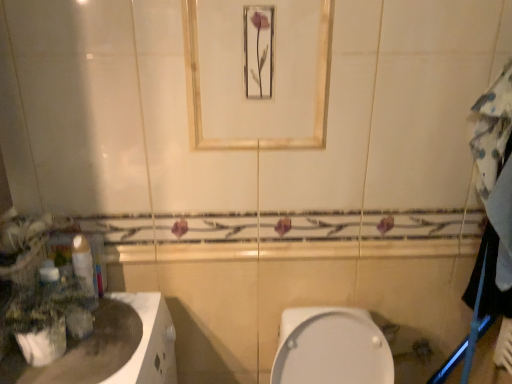
Locate an element on the screen. The height and width of the screenshot is (384, 512). green matte plant at left is located at coordinates (50, 316).

What do you see at coordinates (244, 86) in the screenshot?
I see `matte gold mirror at upper center` at bounding box center [244, 86].

Locate an element on the screen. Image resolution: width=512 pixels, height=384 pixels. white glossy toilet paper at left is located at coordinates (83, 265).

Where is `green matte plant at left`? green matte plant at left is located at coordinates (50, 316).

Between green matte plant at left and white glossy countertop at lower left, which one has smaller width?

green matte plant at left is thinner.

From a real-world perspective, is green matte plant at left over white glossy countertop at lower left?

Indeed, from a real-world perspective, green matte plant at left stands above white glossy countertop at lower left.

The width and height of the screenshot is (512, 384). What are the coordinates of `plant located on the right of white glossy countertop at lower left` in the screenshot? It's located at (50, 316).

Considering the sizes of objects white glossy toilet paper at left and matte gold mirror at upper center in the image provided, who is taller, white glossy toilet paper at left or matte gold mirror at upper center?

matte gold mirror at upper center is taller.

Consider the image. Considering the positions of objects white glossy toilet paper at left and matte gold mirror at upper center in the image provided, who is in front, white glossy toilet paper at left or matte gold mirror at upper center?

matte gold mirror at upper center is closer to the camera.

Is white glossy toilet paper at left positioned with its back to matte gold mirror at upper center?

No, white glossy toilet paper at left is not facing the opposite direction of matte gold mirror at upper center.

How many degrees apart are the facing directions of white glossy toilet paper at left and matte gold mirror at upper center?

There is a 90-degree angle between the facing directions of white glossy toilet paper at left and matte gold mirror at upper center.

Does white glossy countertop at lower left contain matte gold mirror at upper center?

No, matte gold mirror at upper center is not surrounded by white glossy countertop at lower left.

Measure the distance from white glossy countertop at lower left to matte gold mirror at upper center.

white glossy countertop at lower left is 24.92 inches from matte gold mirror at upper center.

Considering the positions of point (109, 356) and point (276, 27), is point (109, 356) closer or farther from the camera than point (276, 27)?

Point (109, 356) is closer to the camera than point (276, 27).

Can you tell me how much white glossy countertop at lower left and matte gold mirror at upper center differ in facing direction?

The angular difference between white glossy countertop at lower left and matte gold mirror at upper center is 90 degrees.

Considering the sizes of objects matte gold mirror at upper center and white glossy countertop at lower left in the image provided, who is smaller, matte gold mirror at upper center or white glossy countertop at lower left?

white glossy countertop at lower left is smaller.

This screenshot has width=512, height=384. I want to click on counter top that appears below the matte gold mirror at upper center (from a real-world perspective), so click(111, 347).

From a real-world perspective, is matte gold mirror at upper center on white glossy countertop at lower left?

Yes, from a real-world perspective, matte gold mirror at upper center is above white glossy countertop at lower left.

Which point is more distant from viewer, (207, 116) or (90, 380)?

The point (207, 116) is behind.

Does matte gold mirror at upper center have a lesser height compared to green matte plant at left?

In fact, matte gold mirror at upper center may be taller than green matte plant at left.

Considering the positions of objects matte gold mirror at upper center and green matte plant at left in the image provided, who is more to the left, matte gold mirror at upper center or green matte plant at left?

Positioned to the left is green matte plant at left.

Looking at this image, from the image's perspective, is matte gold mirror at upper center under green matte plant at left?

No, from the image's perspective, matte gold mirror at upper center is not beneath green matte plant at left.

Considering the sizes of objects matte gold mirror at upper center and green matte plant at left in the image provided, who is bigger, matte gold mirror at upper center or green matte plant at left?

Bigger between the two is green matte plant at left.

From a real-world perspective, relative to white glossy countertop at lower left, is white glossy toilet paper at left vertically above or below?

In terms of real-world spatial position, white glossy toilet paper at left is above white glossy countertop at lower left.

Is there a large distance between white glossy toilet paper at left and white glossy countertop at lower left?

They are positioned close to each other.

From the image's perspective, between white glossy toilet paper at left and white glossy countertop at lower left, which one is located above?

white glossy toilet paper at left.

Considering the relative sizes of green matte plant at left and white glossy toilet paper at left in the image provided, is green matte plant at left taller than white glossy toilet paper at left?

No, green matte plant at left is not taller than white glossy toilet paper at left.

Who is bigger, green matte plant at left or white glossy toilet paper at left?

Bigger between the two is green matte plant at left.

Considering the relative positions of green matte plant at left and white glossy toilet paper at left in the image provided, is green matte plant at left to the right of white glossy toilet paper at left from the viewer's perspective?

No, green matte plant at left is not to the right of white glossy toilet paper at left.

Considering the points (70, 322) and (87, 294), which point is in front, point (70, 322) or point (87, 294)?

The point (87, 294) is in front.

Identify the location of counter top located underneath the green matte plant at left (from a real-world perspective). (111, 347).

This screenshot has width=512, height=384. I want to click on toilet paper that is below the matte gold mirror at upper center (from the image's perspective), so click(83, 265).

Based on their spatial positions, is green matte plant at left or matte gold mirror at upper center further from white glossy countertop at lower left?

The object further to white glossy countertop at lower left is matte gold mirror at upper center.

Considering their positions, is white glossy countertop at lower left positioned closer to green matte plant at left than matte gold mirror at upper center?

white glossy countertop at lower left is closer to green matte plant at left.

Estimate the real-world distances between objects in this image. Which object is further from white glossy toilet paper at left, matte gold mirror at upper center or white glossy countertop at lower left?

The object further to white glossy toilet paper at left is matte gold mirror at upper center.

Looking at the image, which one is located closer to white glossy toilet paper at left, matte gold mirror at upper center or green matte plant at left?

green matte plant at left is positioned closer to the anchor white glossy toilet paper at left.

Looking at this image, estimate the real-world distances between objects in this image. Which object is closer to white glossy toilet paper at left, green matte plant at left or matte gold mirror at upper center?

green matte plant at left.

Estimate the real-world distances between objects in this image. Which object is closer to matte gold mirror at upper center, white glossy countertop at lower left or white glossy toilet paper at left?

white glossy toilet paper at left lies closer to matte gold mirror at upper center than the other object.

Which object lies nearer to the anchor point white glossy toilet paper at left, white glossy countertop at lower left or matte gold mirror at upper center?

The object closer to white glossy toilet paper at left is white glossy countertop at lower left.

Considering their positions, is matte gold mirror at upper center positioned closer to green matte plant at left than white glossy countertop at lower left?

Based on the image, white glossy countertop at lower left appears to be nearer to green matte plant at left.

Find the location of a particular element. This screenshot has width=512, height=384. plant between white glossy countertop at lower left and white glossy toilet paper at left in the front-back direction is located at coordinates (50, 316).

This screenshot has width=512, height=384. Find the location of `toilet paper between matte gold mirror at upper center and white glossy countertop at lower left from top to bottom`. toilet paper between matte gold mirror at upper center and white glossy countertop at lower left from top to bottom is located at coordinates (83, 265).

Find the location of a particular element. This screenshot has width=512, height=384. toilet paper between matte gold mirror at upper center and green matte plant at left vertically is located at coordinates (83, 265).

Locate an element on the screen. Image resolution: width=512 pixels, height=384 pixels. plant between matte gold mirror at upper center and white glossy countertop at lower left from top to bottom is located at coordinates (50, 316).